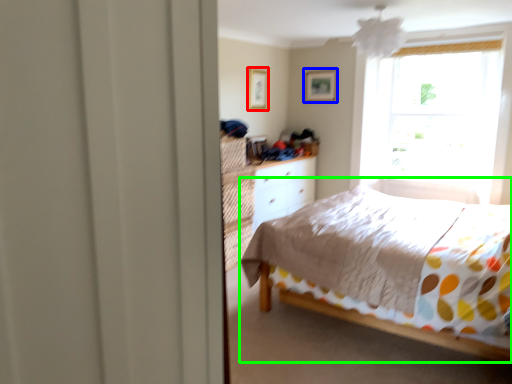
Question: Considering the real-world distances, which object is closest to picture frame (highlighted by a red box)? picture frame (highlighted by a blue box) or bed (highlighted by a green box).

Choices:
 (A) picture frame
 (B) bed

Answer: (A)